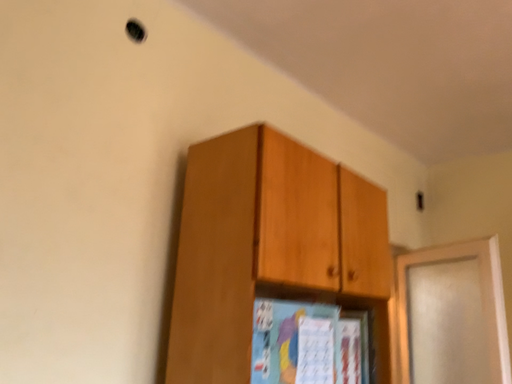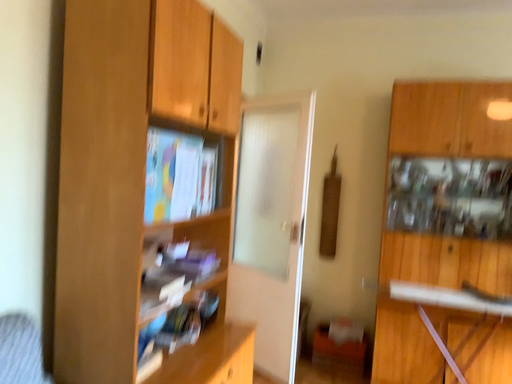
Question: How did the camera likely rotate when shooting the video?

Choices:
 (A) rotated left
 (B) rotated right

Answer: (B)